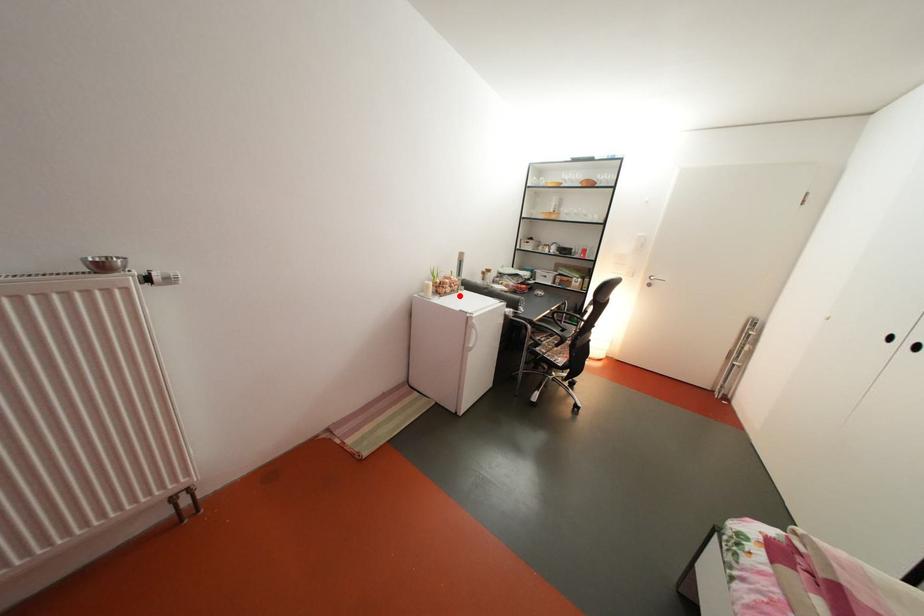
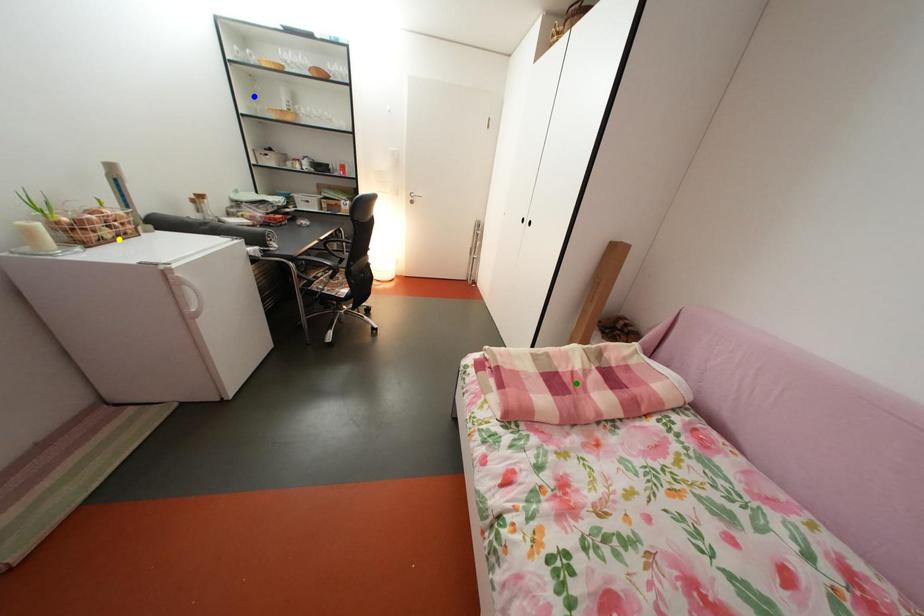
Question: I am providing you with two images of the same scene from different viewpoints. A red point is marked on the first image. You are given multiple points on the second image. Which point in image 2 represents the same 3d spot as the red point in image 1?

Choices:
 (A) blue point
 (B) yellow point
 (C) green point

Answer: (B)